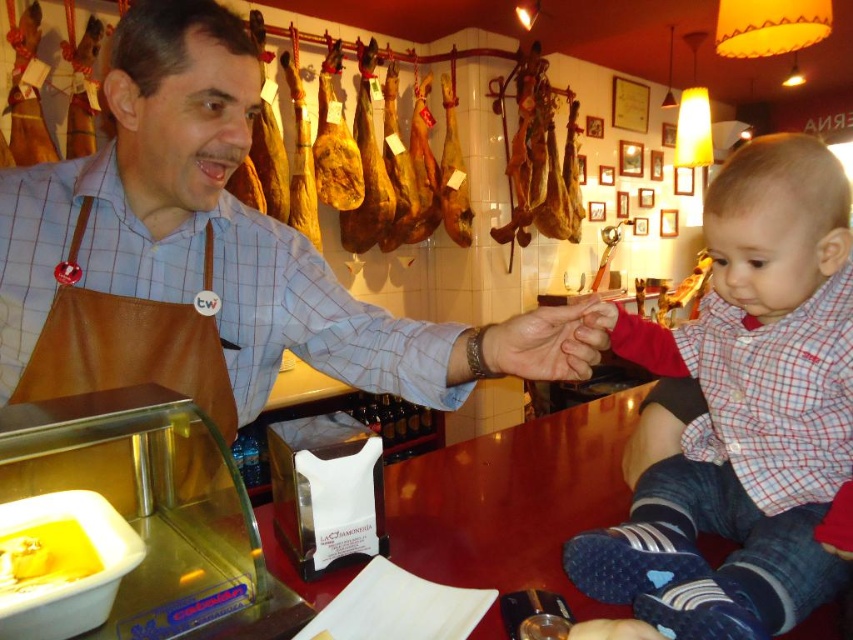
You are a customer in the deli and want to point out the yellow creamy cheese at lower left to the shopkeeper wearing the brown leather apron at center. Which direction should you indicate to the shopkeeper to locate the cheese?

A: The yellow creamy cheese at lower left is located to the left of the brown leather apron at center, so you should indicate to the left.

You are a customer observing the two items in the scene. Which item is shorter in height between the brown leather apron at center and the checkered fabric shirt at right?

The brown leather apron at center has a lesser height compared to the checkered fabric shirt at right, so the brown leather apron at center is shorter in height.

Based on the scene, which object is positioned higher in the image? The brown leather apron at center or the checkered fabric shirt at right?

The brown leather apron at center is positioned higher than the checkered fabric shirt at right in the image.